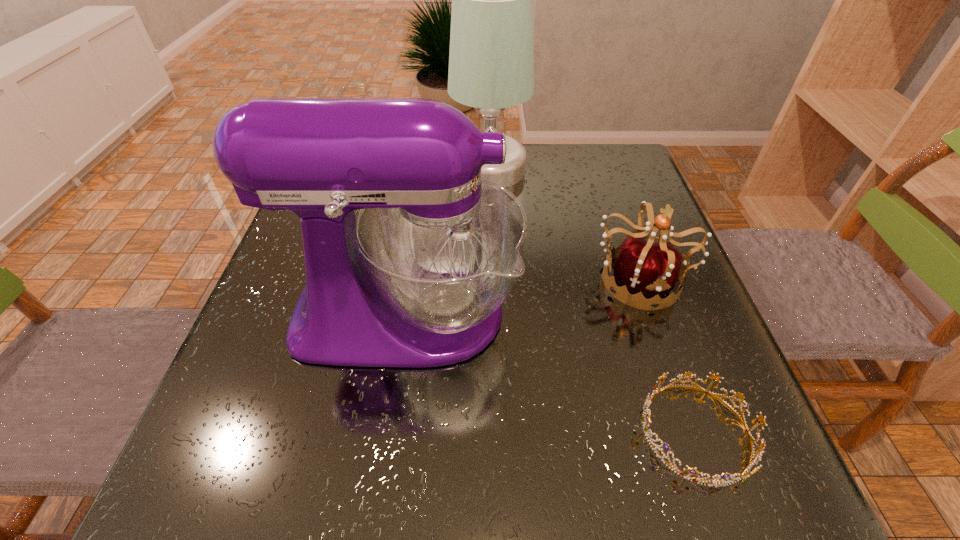
I want to click on object that is the second closest to the taller tiara, so click(x=417, y=279).

Find the location of a particular element. This screenshot has width=960, height=540. vacant region that satisfies the following two spatial constraints: 1. on the front-facing side of the farther tiara; 2. at the bowl opening of the mixer is located at coordinates (652, 314).

Where is `vacant region that satisfies the following two spatial constraints: 1. on the front-facing side of the farther tiara; 2. at the bowl opening of the mixer`? vacant region that satisfies the following two spatial constraints: 1. on the front-facing side of the farther tiara; 2. at the bowl opening of the mixer is located at coordinates (652, 314).